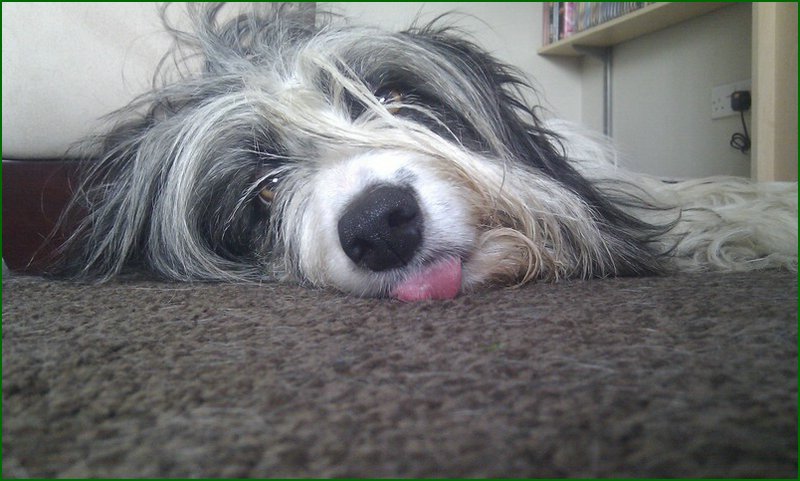
This screenshot has height=481, width=800. I want to click on plug, so click(x=740, y=100).